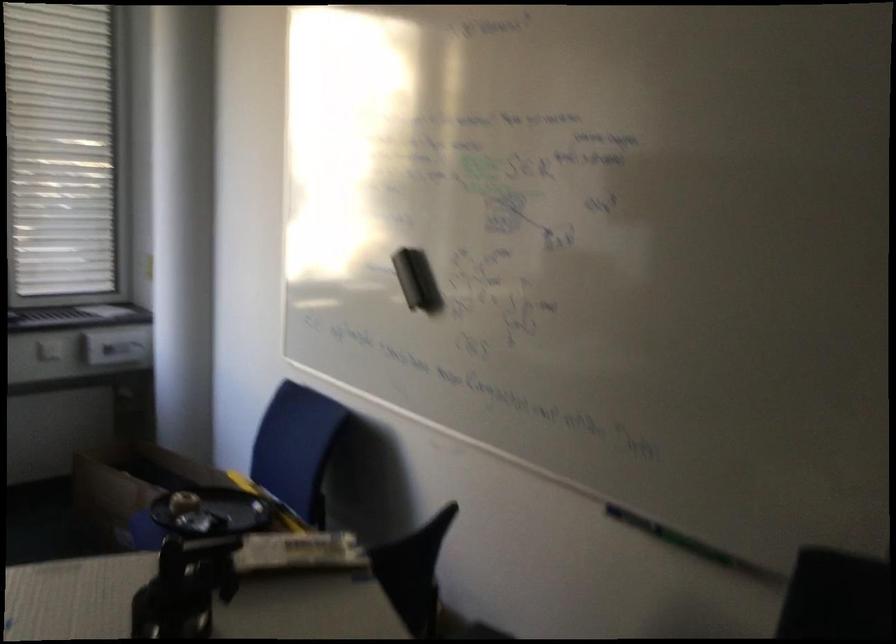
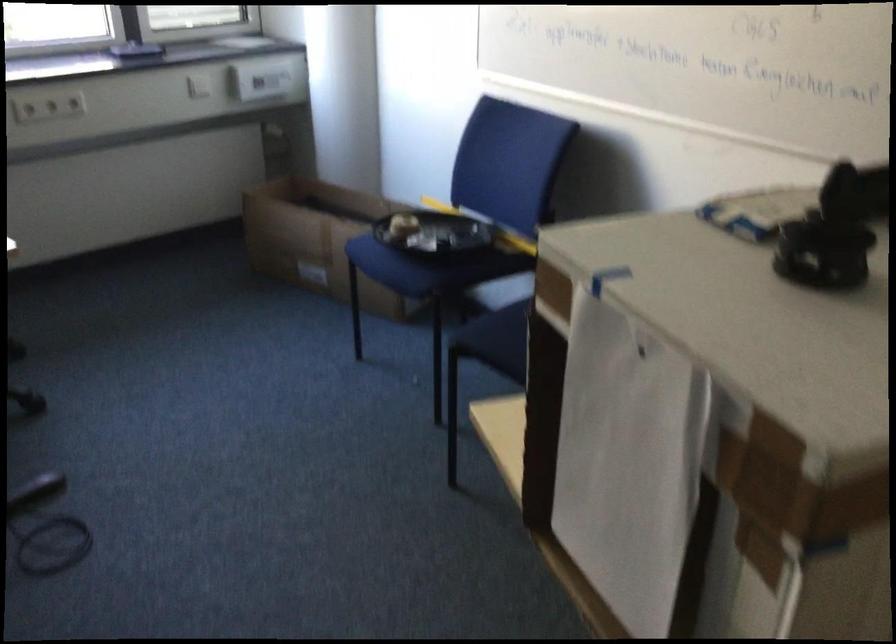
Question: In a continuous first-person perspective shot, in which direction is the camera moving?

Choices:
 (A) Left
 (B) Right
 (C) Forward
 (D) Backward

Answer: (A)